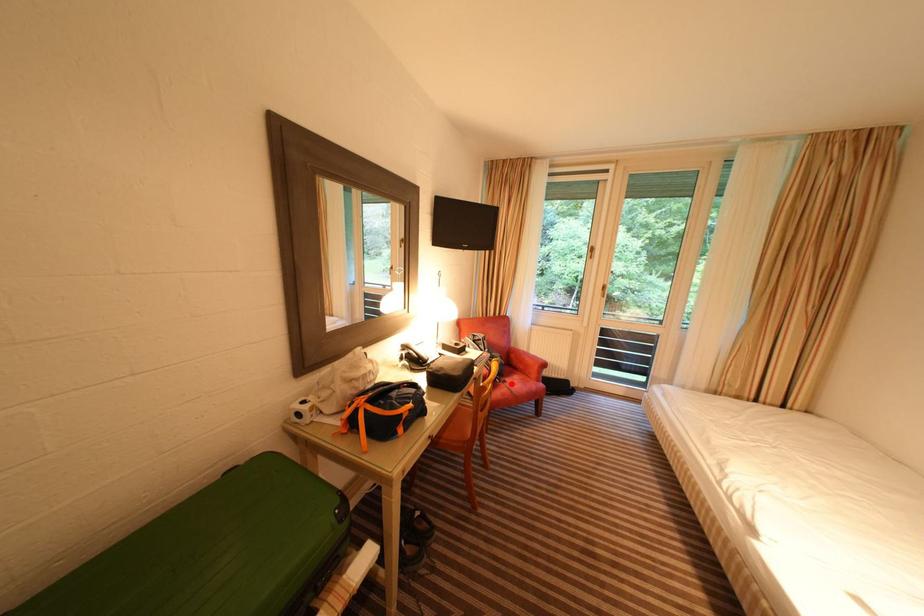
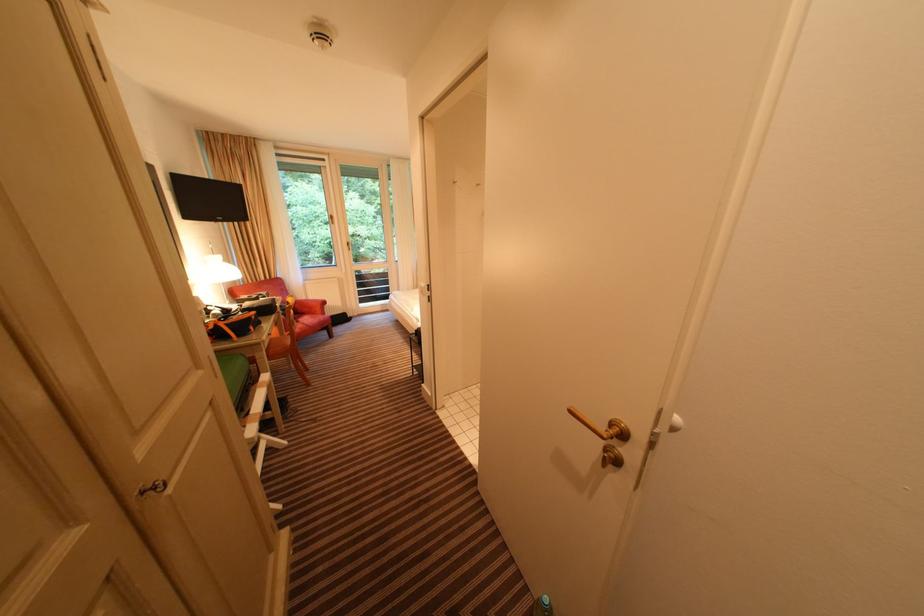
Question: I am providing you with two images of the same scene from different viewpoints. Image1 has a red point marked. In image2, the corresponding 3D location appears at what relative position? Reply with the corresponding letter.

Choices:
 (A) Closer
 (B) Farther

Answer: (A)